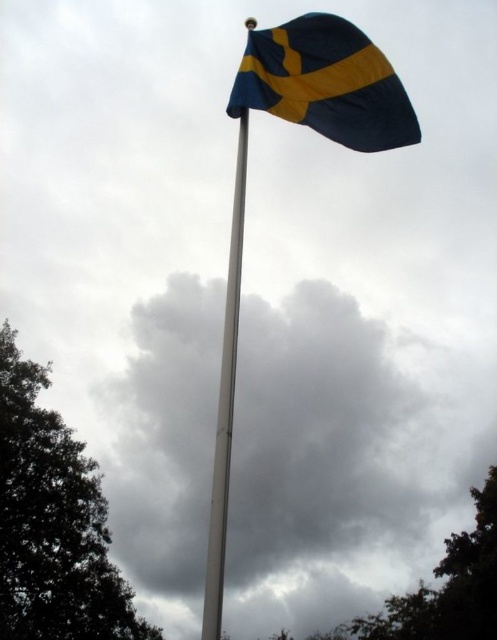
In the scene shown: Does cloudy gray sky at upper center have a smaller size compared to dark green leafy tree at lower left?

No, cloudy gray sky at upper center is not smaller than dark green leafy tree at lower left.

Between point (203, 440) and point (101, 512), which one is positioned in front?

Point (101, 512) is in front.

What are the coordinates of `cloudy gray sky at upper center` in the screenshot? It's located at (341, 460).

Who is more forward, (418, 596) or (230, 291)?

Point (230, 291) is more forward.

Who is higher up, green leafy tree at lower right or white metallic pole at center?

Positioned higher is white metallic pole at center.

The image size is (497, 640). I want to click on green leafy tree at lower right, so click(x=448, y=586).

Is dark green leafy tree at lower left to the right of white metallic pole at center from the viewer's perspective?

Incorrect, dark green leafy tree at lower left is not on the right side of white metallic pole at center.

Image resolution: width=497 pixels, height=640 pixels. I want to click on dark green leafy tree at lower left, so point(53,522).

What do you see at coordinates (53, 522) in the screenshot? Image resolution: width=497 pixels, height=640 pixels. I see `dark green leafy tree at lower left` at bounding box center [53, 522].

You are a GUI agent. You are given a task and a screenshot of the screen. Output one action in this format:
    pyautogui.click(x=<x>, y=<y>)
    Task: Click on the dark green leafy tree at lower left
    
    Given the screenshot: What is the action you would take?
    pyautogui.click(x=53, y=522)